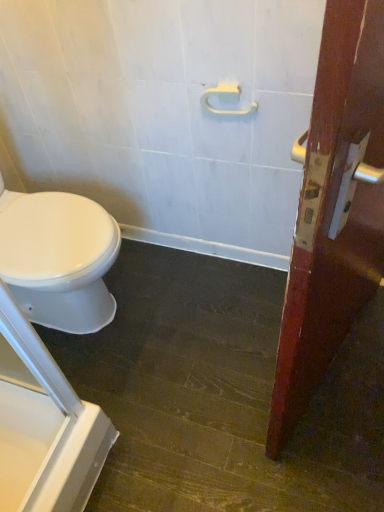
This screenshot has height=512, width=384. Find the location of `vacant space in front of wooden door at right`. vacant space in front of wooden door at right is located at coordinates (339, 439).